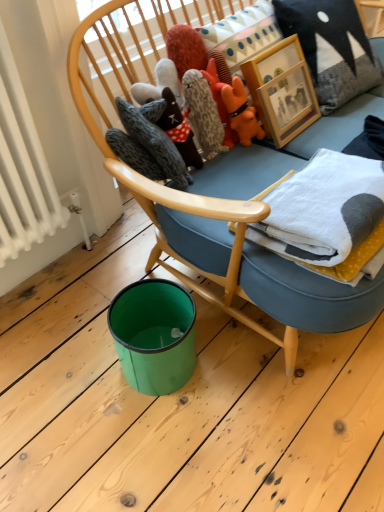
I want to click on fluffy gray stuffed animal at upper center, which appears as the second toy when viewed from the right, so (179, 130).

Image resolution: width=384 pixels, height=512 pixels. What do you see at coordinates (179, 130) in the screenshot?
I see `fluffy gray stuffed animal at upper center, which appears as the second toy when viewed from the right` at bounding box center [179, 130].

Measure the distance between white fleece blanket at upper right and camera.

They are 92.20 centimeters apart.

Locate an element on the screen. textured gray pillow at upper right is located at coordinates (331, 48).

Image resolution: width=384 pixels, height=512 pixels. What are the coordinates of `fluffy gray plush at upper center` in the screenshot? It's located at (203, 113).

Locate an element on the screen. The width and height of the screenshot is (384, 512). wooden picture frame at upper center is located at coordinates (282, 90).

Would you say white fleece blanket at upper right is to the left or to the right of fluffy gray stuffed animal at upper center, which appears as the second toy when viewed from the right, in the picture?

From the image, it's evident that white fleece blanket at upper right is to the right of fluffy gray stuffed animal at upper center, which appears as the second toy when viewed from the right.

Does white fleece blanket at upper right touch fluffy gray stuffed animal at upper center, the 1th toy from the left?

No, white fleece blanket at upper right is not with fluffy gray stuffed animal at upper center, the 1th toy from the left.

From the image's perspective, would you say white fleece blanket at upper right is shown under fluffy gray stuffed animal at upper center, which appears as the second toy when viewed from the right?

Indeed, from the image's perspective, white fleece blanket at upper right is shown beneath fluffy gray stuffed animal at upper center, which appears as the second toy when viewed from the right.

Which is closer to the camera, (374, 243) or (169, 118)?

Point (374, 243) is closer to the camera than point (169, 118).

From a real-world perspective, is textured gray pillow at upper right physically located above or below orange plush toy at upper center, which is the 1th toy from right to left?

From a real-world perspective, textured gray pillow at upper right is physically above orange plush toy at upper center, which is the 1th toy from right to left.

Which of these two, textured gray pillow at upper right or orange plush toy at upper center, which is the 1th toy from right to left, is bigger?

textured gray pillow at upper right.

Between textured gray pillow at upper right and orange plush toy at upper center, which is counted as the second toy, starting from the left, which one has more height?

textured gray pillow at upper right.

Where is `toy that is the 1st object located below the textured gray pillow at upper right (from the image's perspective)`? Image resolution: width=384 pixels, height=512 pixels. toy that is the 1st object located below the textured gray pillow at upper right (from the image's perspective) is located at coordinates (241, 112).

In the image, is fluffy gray plush at upper center positioned in front of or behind white fleece blanket at upper right?

Visually, fluffy gray plush at upper center is located behind white fleece blanket at upper right.

In the image, is fluffy gray plush at upper center on the left side or the right side of white fleece blanket at upper right?

fluffy gray plush at upper center is positioned on white fleece blanket at upper right's left side.

Between fluffy gray plush at upper center and white fleece blanket at upper right, which one has larger size?

With larger size is white fleece blanket at upper right.

Which object is wider, fluffy gray plush at upper center or white fleece blanket at upper right?

Wider between the two is white fleece blanket at upper right.

From a real-world perspective, is white fleece blanket at upper right located beneath orange plush toy at upper center, which is counted as the second toy, starting from the left?

Incorrect, from a real-world perspective, white fleece blanket at upper right is higher than orange plush toy at upper center, which is counted as the second toy, starting from the left.

Would you say white fleece blanket at upper right is a long distance from orange plush toy at upper center, which is counted as the second toy, starting from the left?

No, there isn't a large distance between white fleece blanket at upper right and orange plush toy at upper center, which is counted as the second toy, starting from the left.

Between white fleece blanket at upper right and orange plush toy at upper center, which is counted as the second toy, starting from the left, which one has larger width?

white fleece blanket at upper right is wider.

Considering the relative positions of white fleece blanket at upper right and orange plush toy at upper center, which is counted as the second toy, starting from the left, in the image provided, is white fleece blanket at upper right to the left of orange plush toy at upper center, which is counted as the second toy, starting from the left, from the viewer's perspective?

Incorrect, white fleece blanket at upper right is not on the left side of orange plush toy at upper center, which is counted as the second toy, starting from the left.

In the image, is wooden picture frame at upper center on the left side or the right side of white fleece blanket at upper right?

In the image, wooden picture frame at upper center appears on the left side of white fleece blanket at upper right.

From a real-world perspective, who is located lower, wooden picture frame at upper center or white fleece blanket at upper right?

From a 3D spatial view, wooden picture frame at upper center is below.

Where is `picture frame that is under the white fleece blanket at upper right (from a real-world perspective)`? picture frame that is under the white fleece blanket at upper right (from a real-world perspective) is located at coordinates (282, 90).

From a real-world perspective, does wooden picture frame at upper center stand above textured gray pillow at upper right?

Actually, wooden picture frame at upper center is physically below textured gray pillow at upper right in the real world.

In the scene shown: In the image, is wooden picture frame at upper center on the left side or the right side of textured gray pillow at upper right?

From the image, it's evident that wooden picture frame at upper center is to the left of textured gray pillow at upper right.

In the scene shown: Is wooden picture frame at upper center taller than textured gray pillow at upper right?

In fact, wooden picture frame at upper center may be shorter than textured gray pillow at upper right.

In the image, there is a wooden picture frame at upper center. At what (x,y) coordinates should I click in order to perform the action: click on pillow above it (from the image's perspective). Please return your answer as a coordinate pair (x, y). The image size is (384, 512). Looking at the image, I should click on (331, 48).

Is fluffy gray stuffed animal at upper center, the 1th toy from the left, completely or partially outside of fluffy gray plush at upper center?

fluffy gray stuffed animal at upper center, the 1th toy from the left, is positioned outside fluffy gray plush at upper center.

Is point (189, 144) less distant than point (214, 117)?

Yes, it is in front of point (214, 117).

Are fluffy gray stuffed animal at upper center, the 1th toy from the left, and fluffy gray plush at upper center located far from each other?

fluffy gray stuffed animal at upper center, the 1th toy from the left, is actually quite close to fluffy gray plush at upper center.

Considering the sizes of fluffy gray stuffed animal at upper center, the 1th toy from the left, and fluffy gray plush at upper center in the image, is fluffy gray stuffed animal at upper center, the 1th toy from the left, wider or thinner than fluffy gray plush at upper center?

In the image, fluffy gray stuffed animal at upper center, the 1th toy from the left, appears to be wider than fluffy gray plush at upper center.

At what (x,y) coordinates should I click in order to perform the action: click on toy that is the 1st one when counting backward from the white fleece blanket at upper right. Please return your answer as a coordinate pair (x, y). Image resolution: width=384 pixels, height=512 pixels. Looking at the image, I should click on (179, 130).

From the textured gray pillow at upper right, count 1st toys forward and point to it. Please provide its 2D coordinates.

[(241, 112)]

When comparing their distances from white fleece blanket at upper right, does orange plush toy at upper center, which is counted as the second toy, starting from the left, or textured gray pillow at upper right seem further?

textured gray pillow at upper right lies further to white fleece blanket at upper right than the other object.

Based on their spatial positions, is fluffy gray plush at upper center or textured gray pillow at upper right closer to fluffy gray stuffed animal at upper center, which appears as the second toy when viewed from the right?

fluffy gray plush at upper center is positioned closer to the anchor fluffy gray stuffed animal at upper center, which appears as the second toy when viewed from the right.

From the image, which object appears to be nearer to fluffy gray stuffed animal at upper center, the 1th toy from the left, orange plush toy at upper center, which is counted as the second toy, starting from the left, or fluffy gray plush at upper center?

The object closer to fluffy gray stuffed animal at upper center, the 1th toy from the left, is fluffy gray plush at upper center.

When comparing their distances from textured gray pillow at upper right, does fluffy gray stuffed animal at upper center, which appears as the second toy when viewed from the right, or orange plush toy at upper center, which is the 1th toy from right to left, seem further?

fluffy gray stuffed animal at upper center, which appears as the second toy when viewed from the right.

Which object lies nearer to the anchor point wooden picture frame at upper center, white fleece blanket at upper right or textured gray pillow at upper right?

textured gray pillow at upper right is closer to wooden picture frame at upper center.

In the scene shown: Which object lies nearer to the anchor point fluffy gray stuffed animal at upper center, which appears as the second toy when viewed from the right, white fleece blanket at upper right or textured gray pillow at upper right?

white fleece blanket at upper right.

From the image, which object appears to be nearer to wooden picture frame at upper center, textured gray pillow at upper right or white fleece blanket at upper right?

Based on the image, textured gray pillow at upper right appears to be nearer to wooden picture frame at upper center.

When comparing their distances from fluffy gray plush at upper center, does textured gray pillow at upper right or fluffy gray stuffed animal at upper center, which appears as the second toy when viewed from the right, seem closer?

Among the two, fluffy gray stuffed animal at upper center, which appears as the second toy when viewed from the right, is located nearer to fluffy gray plush at upper center.

Identify the location of toy between fluffy gray stuffed animal at upper center, the 1th toy from the left, and wooden picture frame at upper center. Image resolution: width=384 pixels, height=512 pixels. (241, 112).

This screenshot has height=512, width=384. What are the coordinates of `toy positioned between white fleece blanket at upper right and orange plush toy at upper center, which is counted as the second toy, starting from the left, from near to far` in the screenshot? It's located at (179, 130).

Where is `cloth located between fluffy gray stuffed animal at upper center, which appears as the second toy when viewed from the right, and wooden picture frame at upper center in the left-right direction`? The image size is (384, 512). cloth located between fluffy gray stuffed animal at upper center, which appears as the second toy when viewed from the right, and wooden picture frame at upper center in the left-right direction is located at coordinates (203, 113).

What are the coordinates of `picture frame that lies between textured gray pillow at upper right and white fleece blanket at upper right from top to bottom` in the screenshot? It's located at pyautogui.click(x=282, y=90).